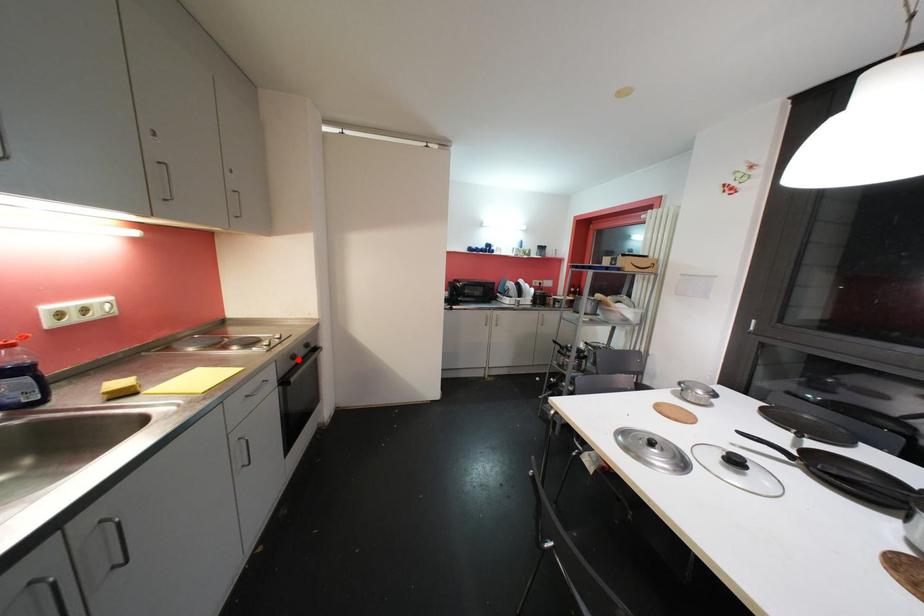
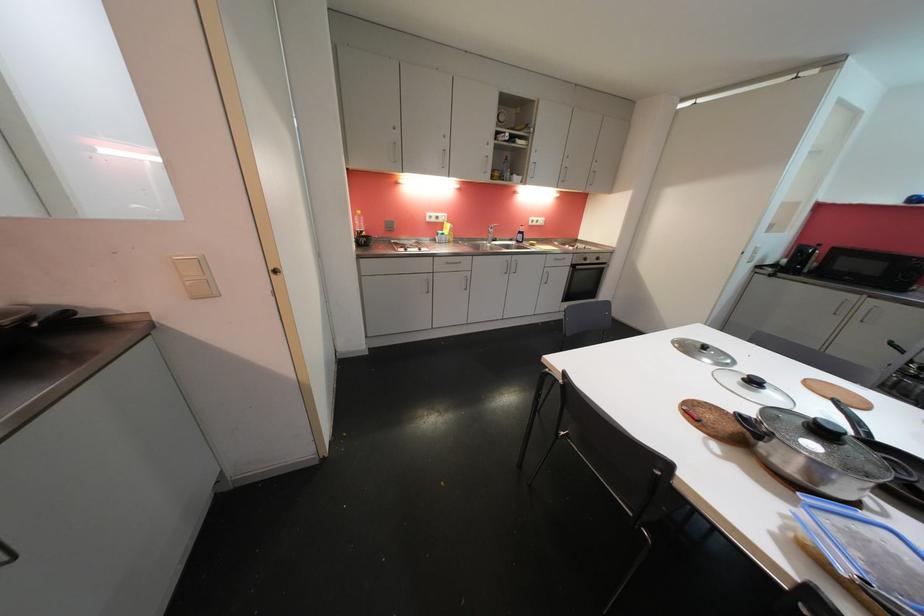
In the second image, find the point that corresponds to the highlighted location in the first image.

(590, 262)